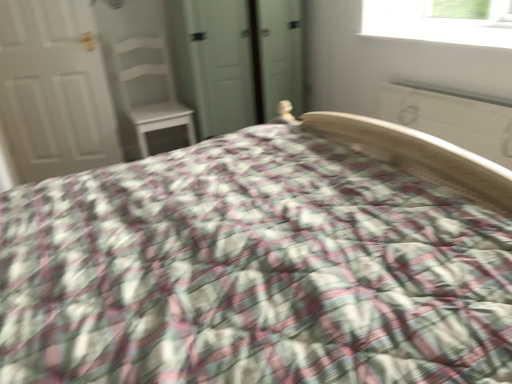
Question: Which is correct: white wood chair at upper left is inside white painted wood radiator at upper right, or outside of it?

Choices:
 (A) inside
 (B) outside

Answer: (B)

Question: Is point (118, 46) positioned closer to the camera than point (434, 127)?

Choices:
 (A) farther
 (B) closer

Answer: (A)

Question: Which of these objects is positioned farthest from the white painted wood radiator at upper right?

Choices:
 (A) white wood chair at upper left
 (B) green matte wardrobe at center
 (C) white smooth window sill at upper right
 (D) plaid fabric bed at center
 (E) white matte door at left

Answer: (E)

Question: Which object is positioned farthest from the white matte door at left?

Choices:
 (A) plaid fabric bed at center
 (B) green matte wardrobe at center
 (C) white painted wood radiator at upper right
 (D) white smooth window sill at upper right
 (E) white wood chair at upper left

Answer: (C)